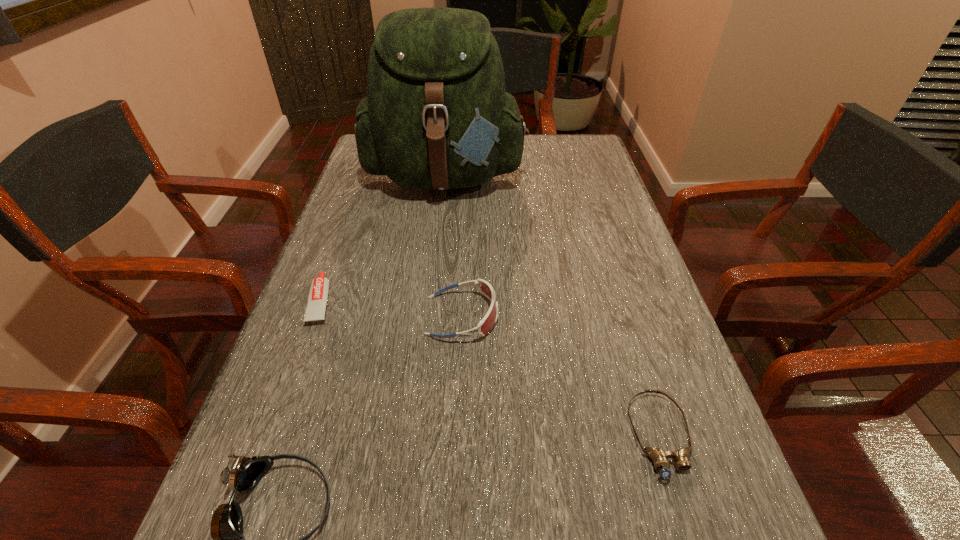
Where is `backpack`? This screenshot has height=540, width=960. backpack is located at coordinates (436, 116).

Locate an element on the screen. The height and width of the screenshot is (540, 960). the tallest object is located at coordinates (436, 116).

Where is `the second goggles from right to left`? The width and height of the screenshot is (960, 540). the second goggles from right to left is located at coordinates (486, 324).

The width and height of the screenshot is (960, 540). I want to click on toothpaste, so click(x=318, y=294).

The height and width of the screenshot is (540, 960). Identify the location of the rightmost goggles. (659, 457).

At what (x,y) coordinates should I click in order to perform the action: click on the shortest goggles. Please return your answer as a coordinate pair (x, y). Image resolution: width=960 pixels, height=540 pixels. Looking at the image, I should click on (659, 457).

Find the location of a particular element. The image size is (960, 540). vacant point located on the open flap of the farthest object is located at coordinates (x=430, y=318).

This screenshot has width=960, height=540. In order to click on blank space located on the front-facing side of the farthest goggles in this screenshot , I will do `click(591, 316)`.

Find the location of a particular element. This screenshot has width=960, height=540. free spot located on the front of the toothpaste is located at coordinates (273, 435).

Find the location of `vacant space positioned 0.060m on the front lenses and sides of the rightmost object`. vacant space positioned 0.060m on the front lenses and sides of the rightmost object is located at coordinates (689, 529).